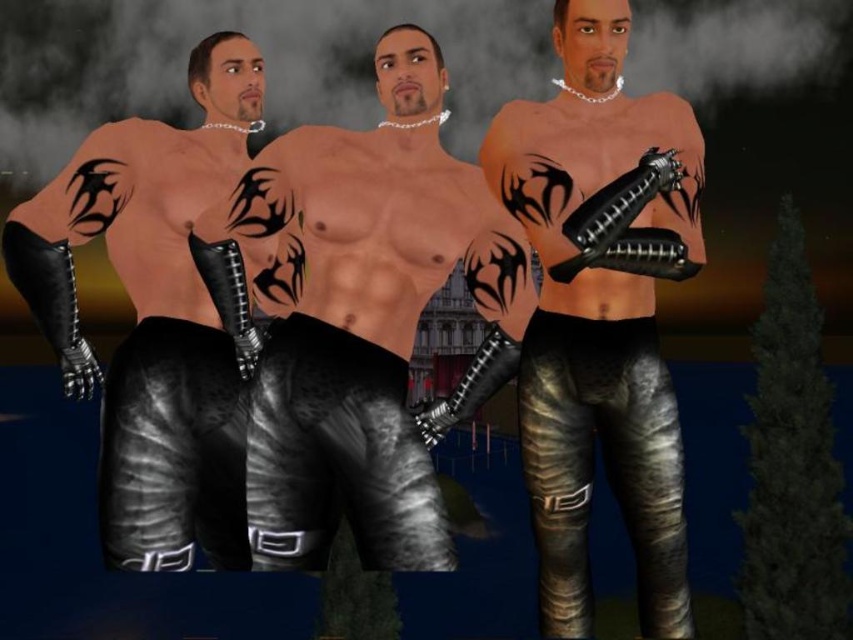
You are a fashion designer analyzing the image of three individuals. The metallic black pants at center and matte black leather pants at left are both in the scene. Which pair of pants appears larger in height?

The metallic black pants at center appears much taller than the matte black leather pants at left.

You are standing in front of the three individuals and notice two points marked on their clothing. The first point is at coordinates point (569, 547) and the second at point (231, 180). Which point is closer to you?

Point (569, 547) is in front of point (231, 180), so the first point is closer to you.